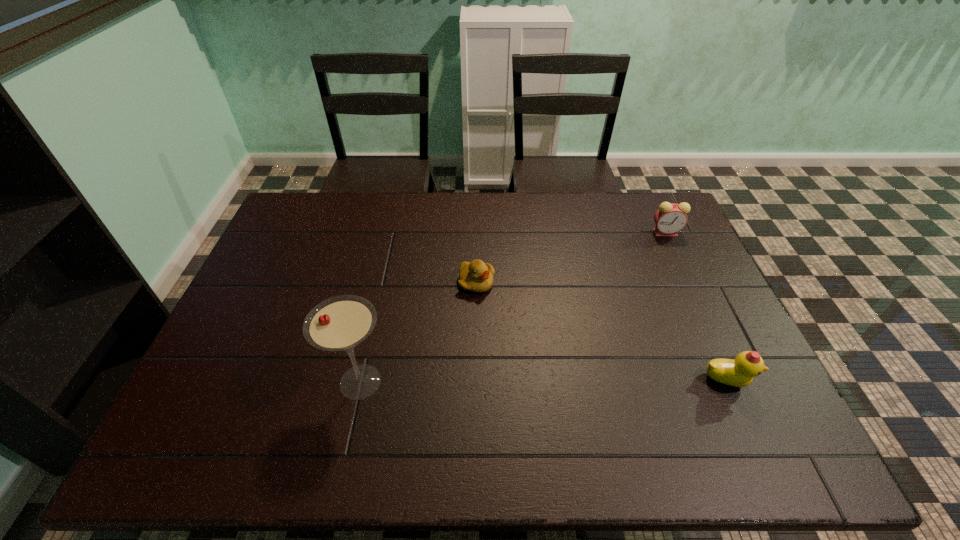
What are the coordinates of `the tallest object` in the screenshot? It's located at (340, 323).

At what (x,y) coordinates should I click in order to perform the action: click on martini. Please return your answer as a coordinate pair (x, y). Looking at the image, I should click on (340, 323).

Where is `the right duckling`? the right duckling is located at coordinates (740, 372).

Find the location of a particular element. The width and height of the screenshot is (960, 540). the taller duckling is located at coordinates (740, 372).

You are a GUI agent. You are given a task and a screenshot of the screen. Output one action in this format:
    pyautogui.click(x=<x>, y=<y>)
    Task: Click on the shortest object
    
    Given the screenshot: What is the action you would take?
    pyautogui.click(x=476, y=276)

The height and width of the screenshot is (540, 960). Find the location of `the shorter duckling`. the shorter duckling is located at coordinates (476, 276).

Locate an element on the screen. The width and height of the screenshot is (960, 540). alarm clock is located at coordinates click(x=670, y=218).

At what (x,y) coordinates should I click in order to perform the action: click on free space located 0.250m on the right of the tallest object. Please return your answer as a coordinate pair (x, y). This screenshot has width=960, height=540. Looking at the image, I should click on (492, 382).

Where is `vacant space located 0.080m at the beak of the left duckling`? The image size is (960, 540). vacant space located 0.080m at the beak of the left duckling is located at coordinates (506, 308).

I want to click on vacant space located at the beak of the left duckling, so click(x=542, y=341).